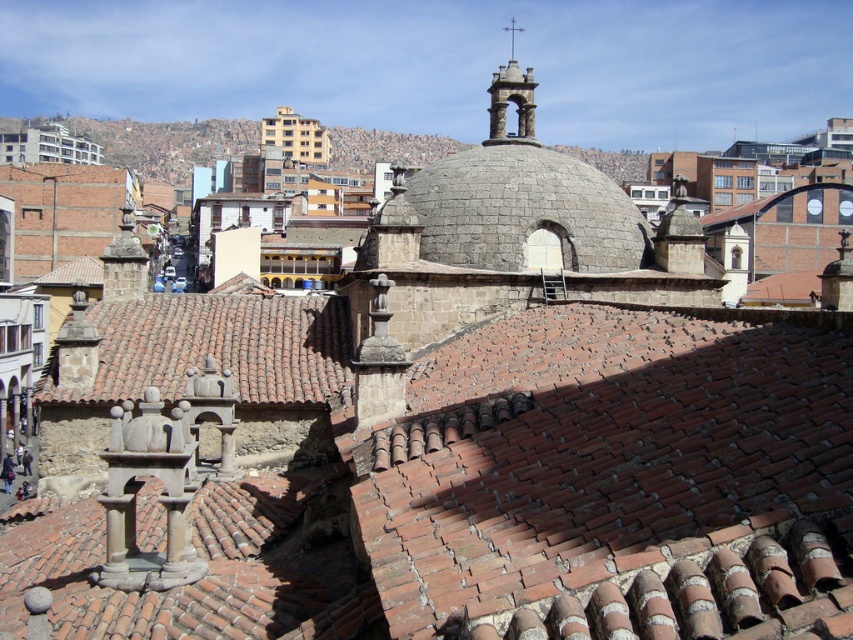
Question: Is brown clay tiles at center to the left of gray stone dome at center from the viewer's perspective?

Choices:
 (A) yes
 (B) no

Answer: (A)

Question: Does brown tile roof at center lie behind gray stone dome at center?

Choices:
 (A) yes
 (B) no

Answer: (B)

Question: Which of the following is the closest to the observer?

Choices:
 (A) (421, 170)
 (B) (315, 531)

Answer: (B)

Question: Can you confirm if brown clay tiles at center is positioned to the right of brown tile roof at center?

Choices:
 (A) yes
 (B) no

Answer: (A)

Question: Which point is closer to the camera?

Choices:
 (A) gray stone dome at center
 (B) brown clay tiles at center
 (C) brown tile roof at center

Answer: (B)

Question: Which is farther from the gray stone dome at center?

Choices:
 (A) brown clay tiles at center
 (B) brown tile roof at center

Answer: (A)